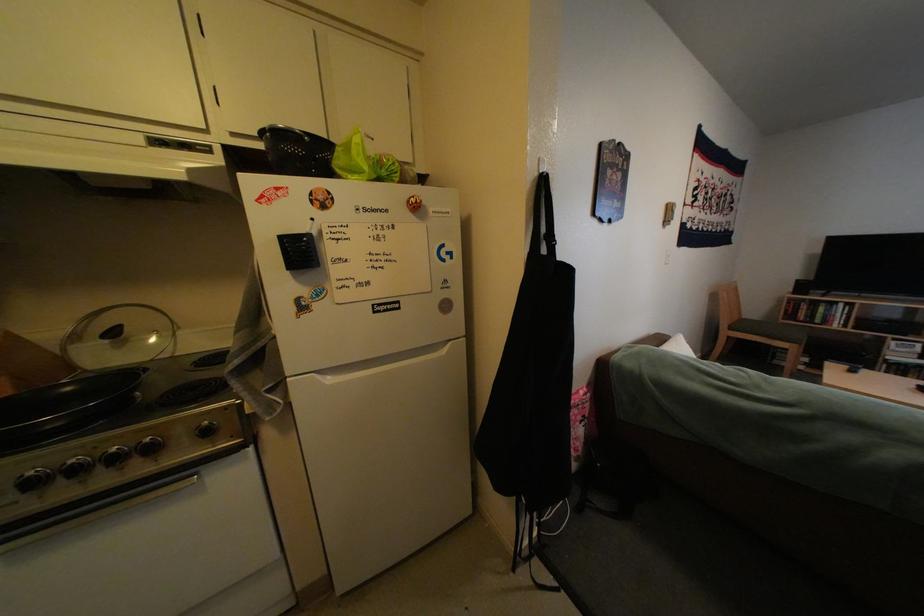
Find where to lift the green produce bag. Please return your answer as a coordinate pair (x, y).

(366, 161)